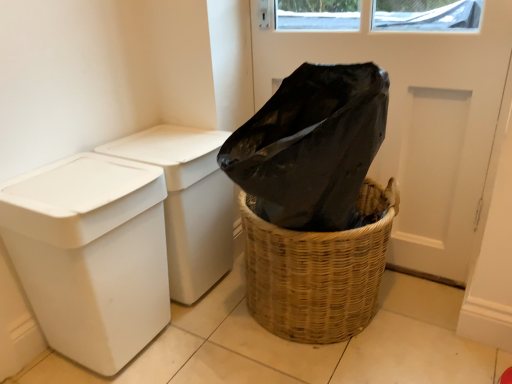
Question: From their relative heights in the image, would you say white plastic bin at left, which is counted as the second waste container, starting from the back, is taller or shorter than black plastic screen door at upper center?

Choices:
 (A) tall
 (B) short

Answer: (B)

Question: Is white plastic bin at left, which is counted as the second waste container, starting from the back, bigger or smaller than black plastic screen door at upper center?

Choices:
 (A) small
 (B) big

Answer: (A)

Question: Which object is positioned farthest from the white plastic bin at left, which is the 1th waste container in front-to-back order?

Choices:
 (A) woven brown basket at lower right
 (B) white plastic bin at left, which is the 2th waste container from front to back
 (C) black plastic screen door at upper center

Answer: (C)

Question: Considering the real-world distances, which object is farthest from the white plastic bin at left, which is the 2th waste container from front to back?

Choices:
 (A) white plastic bin at left, which is the 1th waste container in front-to-back order
 (B) woven brown basket at lower right
 (C) black plastic screen door at upper center

Answer: (C)